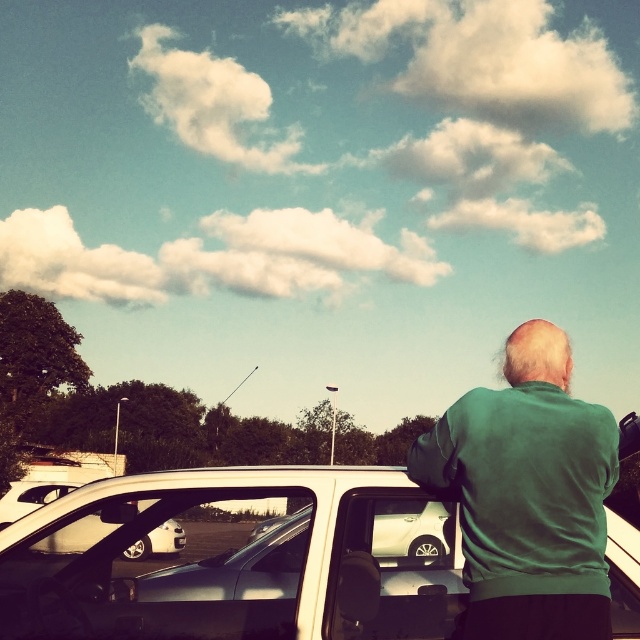
Question: Can you confirm if white matte car at center is smaller than green matte jacket at upper right?

Choices:
 (A) yes
 (B) no

Answer: (B)

Question: Which of the following is the farthest from the observer?

Choices:
 (A) (577, 579)
 (B) (445, 506)

Answer: (B)

Question: In this image, where is white matte car at center located relative to green matte jacket at upper right?

Choices:
 (A) left
 (B) right

Answer: (A)

Question: Does white matte car at center lie behind green matte jacket at upper right?

Choices:
 (A) yes
 (B) no

Answer: (A)